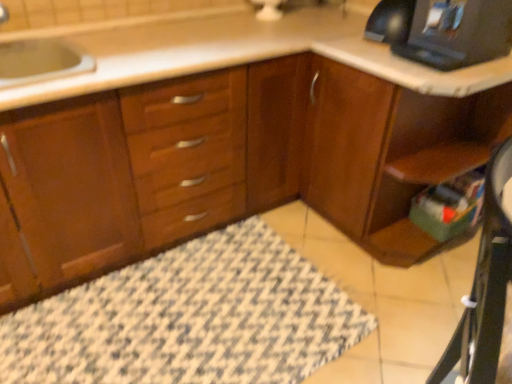
Question: Is wooden cabinet at center positioned with its back to patterned fabric bath mat at lower center?

Choices:
 (A) yes
 (B) no

Answer: (B)

Question: From the image's perspective, is wooden cabinet at center below patterned fabric bath mat at lower center?

Choices:
 (A) yes
 (B) no

Answer: (B)

Question: Can you confirm if wooden cabinet at center is positioned to the right of patterned fabric bath mat at lower center?

Choices:
 (A) no
 (B) yes

Answer: (B)

Question: Is wooden cabinet at center to the left of patterned fabric bath mat at lower center from the viewer's perspective?

Choices:
 (A) no
 (B) yes

Answer: (A)

Question: Is wooden cabinet at center closer to camera compared to patterned fabric bath mat at lower center?

Choices:
 (A) yes
 (B) no

Answer: (A)

Question: Is wooden cabinet at center aimed at patterned fabric bath mat at lower center?

Choices:
 (A) yes
 (B) no

Answer: (B)

Question: Considering the relative positions of black plastic desktop computer at upper right and wooden cabinet at center in the image provided, is black plastic desktop computer at upper right to the right of wooden cabinet at center from the viewer's perspective?

Choices:
 (A) no
 (B) yes

Answer: (B)

Question: Is black plastic desktop computer at upper right facing away from wooden cabinet at center?

Choices:
 (A) yes
 (B) no

Answer: (B)

Question: Is black plastic desktop computer at upper right completely or partially outside of wooden cabinet at center?

Choices:
 (A) no
 (B) yes

Answer: (B)

Question: From a real-world perspective, is black plastic desktop computer at upper right over wooden cabinet at center?

Choices:
 (A) no
 (B) yes

Answer: (B)

Question: Is black plastic desktop computer at upper right shorter than wooden cabinet at center?

Choices:
 (A) yes
 (B) no

Answer: (A)

Question: Can you confirm if black plastic desktop computer at upper right is taller than wooden cabinet at center?

Choices:
 (A) no
 (B) yes

Answer: (A)

Question: From the image's perspective, is wooden computer desk at lower right above wooden cabinet at center?

Choices:
 (A) no
 (B) yes

Answer: (A)